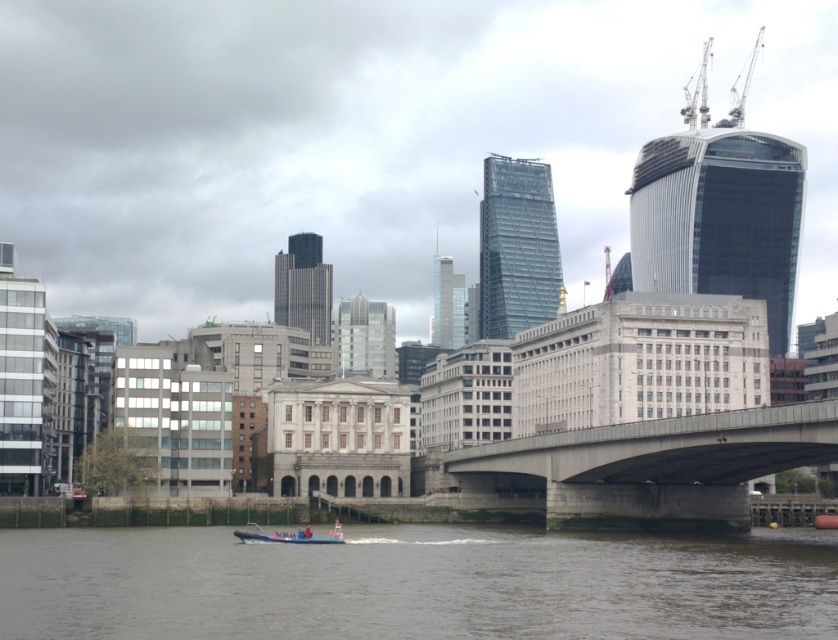
You are standing on the riverbank and see the brown water at lower center and the blue rubber boat at lower center. Which object is closer to you?

The brown water at lower center is closer to you because it is positioned in front of the blue rubber boat at lower center.

In the scene shown: You are a drone operator trying to capture a photo of the cityscape. The drone is currently at a position above the river. To ensure the photo includes the brown water at lower center, where should you position the drone relative to the bridge?

The brown water at lower center is located at point (415, 584), so you should position the drone above the bridge to capture the brown water at lower center in the photo.

You are a drone operator trying to capture a photo of the concrete bridge at center from above. Your drone is currently hovering at point A, which is at coordinates [653,467]. Is your drone already positioned directly above the concrete bridge at center?

Yes, the concrete bridge at center is located at point [653,467], so the drone is already positioned directly above the concrete bridge at center.